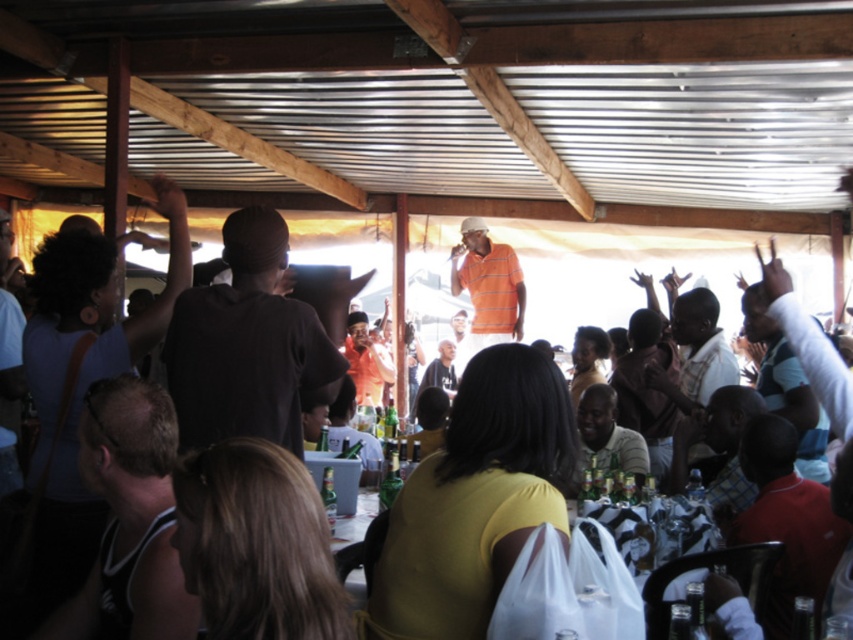
Question: Which of these objects is positioned farthest from the dark brown hair at lower left?

Choices:
 (A) red shirt at lower right
 (B) black matte shirt at center
 (C) orange striped polo shirt at center
 (D) plaid shirt at center

Answer: (C)

Question: Which point appears farthest from the camera in this image?

Choices:
 (A) (57, 618)
 (B) (514, 336)

Answer: (B)

Question: Is dark brown hair at lower left positioned in front of orange striped polo shirt at center?

Choices:
 (A) no
 (B) yes

Answer: (B)

Question: Can you confirm if black matte shirt at center is positioned to the right of red shirt at lower right?

Choices:
 (A) no
 (B) yes

Answer: (A)

Question: Which of the following is the closest to the observer?

Choices:
 (A) (136, 561)
 (B) (708, 349)
 (C) (503, 282)

Answer: (A)

Question: Can you confirm if dark brown hair at lower left is positioned to the right of red shirt at lower right?

Choices:
 (A) no
 (B) yes

Answer: (A)